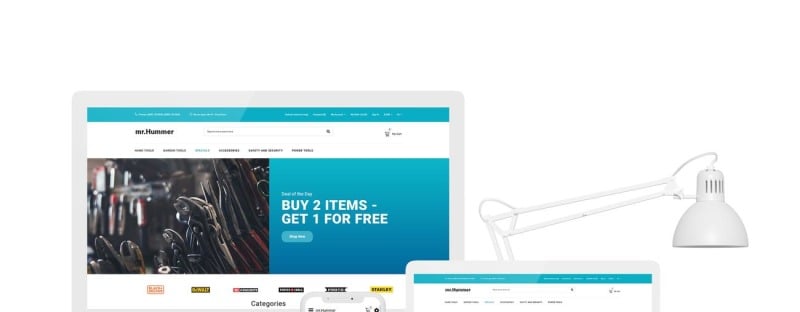
At what (x,y) coordinates should I click in order to perform the action: click on vents. Please return your answer as a coordinate pair (x, y). This screenshot has height=312, width=800. Looking at the image, I should click on (710, 186).